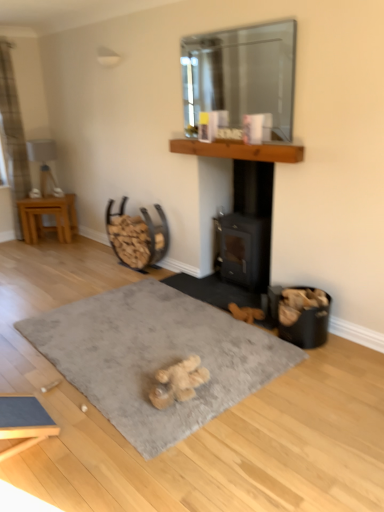
This screenshot has width=384, height=512. Identify the location of empty space that is to the right of fuzzy beige teddy bear at center. (238, 379).